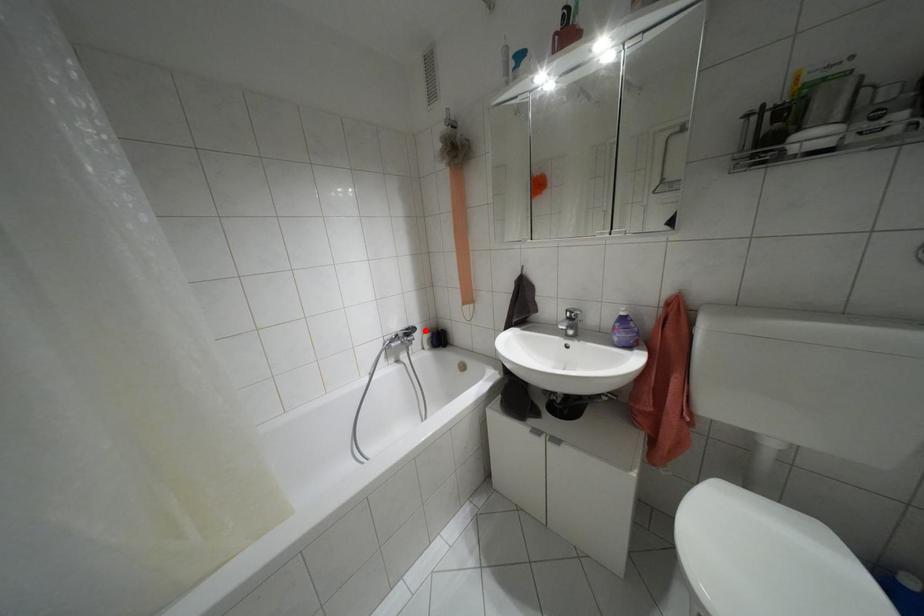
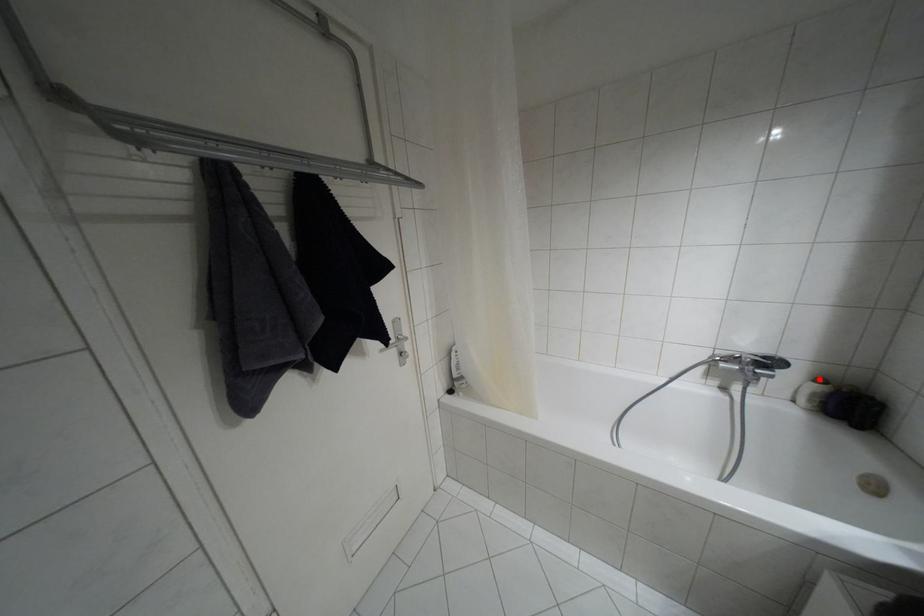
I am providing you with two images of the same scene from different viewpoints. A red point is marked on the first image and another point is marked on the second image. Is the red point in image1 aligned with the point shown in image2?

Yes